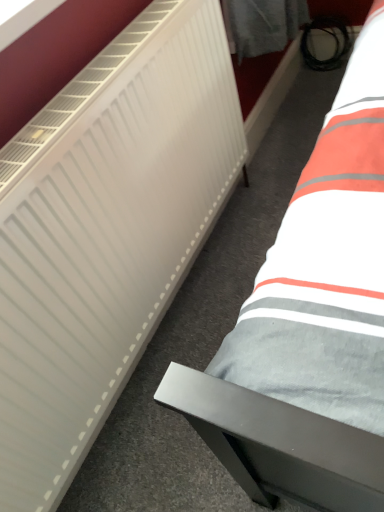
The height and width of the screenshot is (512, 384). What do you see at coordinates (105, 232) in the screenshot? I see `white matte radiator at left` at bounding box center [105, 232].

The width and height of the screenshot is (384, 512). I want to click on white matte radiator at left, so click(105, 232).

What is the approximate height of gray fabric bed at lower right?

It is 2.48 inches.

Identify the location of gray fabric bed at lower right. (310, 323).

This screenshot has width=384, height=512. What do you see at coordinates (310, 323) in the screenshot?
I see `gray fabric bed at lower right` at bounding box center [310, 323].

Find the location of a particular element. This screenshot has width=384, height=512. white matte radiator at left is located at coordinates (105, 232).

Considering the relative positions of white matte radiator at left and gray fabric bed at lower right in the image provided, is white matte radiator at left to the right of gray fabric bed at lower right from the viewer's perspective?

No, white matte radiator at left is not to the right of gray fabric bed at lower right.

Is white matte radiator at left further to the viewer compared to gray fabric bed at lower right?

That is False.

Considering the positions of point (72, 303) and point (296, 271), is point (72, 303) closer or farther from the camera than point (296, 271)?

Point (72, 303) is farther from the camera than point (296, 271).

From the image's perspective, is white matte radiator at left above gray fabric bed at lower right?

No, from the image's perspective, white matte radiator at left is not above gray fabric bed at lower right.

Consider the image. From a real-world perspective, does white matte radiator at left sit lower than gray fabric bed at lower right?

No.

Is white matte radiator at left wider or thinner than gray fabric bed at lower right?

In the image, white matte radiator at left appears to be more narrow than gray fabric bed at lower right.

Between white matte radiator at left and gray fabric bed at lower right, which one has less height?

gray fabric bed at lower right is shorter.

Considering the sizes of objects white matte radiator at left and gray fabric bed at lower right in the image provided, who is smaller, white matte radiator at left or gray fabric bed at lower right?

gray fabric bed at lower right is smaller.

Is white matte radiator at left completely or partially outside of gray fabric bed at lower right?

white matte radiator at left is positioned outside gray fabric bed at lower right.

Is white matte radiator at left next to gray fabric bed at lower right?

No.

Is white matte radiator at left looking in the opposite direction of gray fabric bed at lower right?

No.

Consider the image. How many degrees apart are the facing directions of white matte radiator at left and gray fabric bed at lower right?

They differ by 90.3 degrees in their facing directions.

Image resolution: width=384 pixels, height=512 pixels. Identify the location of radiator to the left of gray fabric bed at lower right. (105, 232).

Is gray fabric bed at lower right to the right of white matte radiator at left from the viewer's perspective?

Yes.

Does gray fabric bed at lower right lie behind white matte radiator at left?

Yes, the depth of gray fabric bed at lower right is greater than that of white matte radiator at left.

Considering the points (289, 449) and (41, 226), which point is behind, point (289, 449) or point (41, 226)?

The point (41, 226) is farther.

From the picture: From the image's perspective, is gray fabric bed at lower right above or below white matte radiator at left?

From the image's perspective, gray fabric bed at lower right appears above white matte radiator at left.

From a real-world perspective, who is located higher, gray fabric bed at lower right or white matte radiator at left?

white matte radiator at left is physically above.

Does gray fabric bed at lower right have a lesser width compared to white matte radiator at left?

No.

Is gray fabric bed at lower right shorter than white matte radiator at left?

Yes.

From the picture: Can you confirm if gray fabric bed at lower right is smaller than white matte radiator at left?

Indeed, gray fabric bed at lower right has a smaller size compared to white matte radiator at left.

Which is correct: gray fabric bed at lower right is inside white matte radiator at left, or outside of it?

gray fabric bed at lower right cannot be found inside white matte radiator at left.

Can you see gray fabric bed at lower right touching white matte radiator at left?

No, gray fabric bed at lower right is not touching white matte radiator at left.

Is gray fabric bed at lower right turned away from white matte radiator at left?

gray fabric bed at lower right is not turned away from white matte radiator at left.

How different are the orientations of gray fabric bed at lower right and white matte radiator at left in degrees?

There is a 90.3-degree angle between the facing directions of gray fabric bed at lower right and white matte radiator at left.

Measure the distance from gray fabric bed at lower right to white matte radiator at left.

The distance of gray fabric bed at lower right from white matte radiator at left is 16.17 inches.

Image resolution: width=384 pixels, height=512 pixels. Find the location of `radiator on the left side of gray fabric bed at lower right`. radiator on the left side of gray fabric bed at lower right is located at coordinates (105, 232).

Find the location of a particular element. radiator below the gray fabric bed at lower right (from the image's perspective) is located at coordinates (105, 232).

Where is `bed behind the white matte radiator at left`? Image resolution: width=384 pixels, height=512 pixels. bed behind the white matte radiator at left is located at coordinates (310, 323).